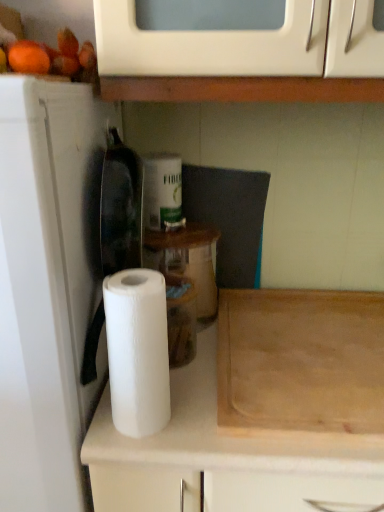
Question: Considering the relative sizes of wooden cutting board at lower right and white matte paper towel at center in the image provided, is wooden cutting board at lower right shorter than white matte paper towel at center?

Choices:
 (A) yes
 (B) no

Answer: (A)

Question: Is wooden cutting board at lower right at the left side of white matte paper towel at center?

Choices:
 (A) no
 (B) yes

Answer: (A)

Question: From the image's perspective, is wooden cutting board at lower right located beneath white matte paper towel at center?

Choices:
 (A) yes
 (B) no

Answer: (A)

Question: Does wooden cutting board at lower right have a greater height compared to white matte paper towel at center?

Choices:
 (A) yes
 (B) no

Answer: (B)

Question: Is wooden cutting board at lower right smaller than white matte paper towel at center?

Choices:
 (A) no
 (B) yes

Answer: (A)

Question: From a real-world perspective, is wooden cutting board at lower right physically below white matte paper towel at center?

Choices:
 (A) no
 (B) yes

Answer: (B)

Question: Can you confirm if white matte paper towel roll at center is taller than wooden cutting board at lower right?

Choices:
 (A) no
 (B) yes

Answer: (B)

Question: Considering the relative positions of white matte paper towel roll at center and wooden cutting board at lower right in the image provided, is white matte paper towel roll at center to the right of wooden cutting board at lower right from the viewer's perspective?

Choices:
 (A) no
 (B) yes

Answer: (A)

Question: Does white matte paper towel roll at center have a smaller size compared to wooden cutting board at lower right?

Choices:
 (A) yes
 (B) no

Answer: (B)

Question: Considering the relative positions of white matte paper towel roll at center and wooden cutting board at lower right in the image provided, is white matte paper towel roll at center to the left of wooden cutting board at lower right from the viewer's perspective?

Choices:
 (A) no
 (B) yes

Answer: (B)

Question: From a real-world perspective, is white matte paper towel roll at center located beneath wooden cutting board at lower right?

Choices:
 (A) no
 (B) yes

Answer: (B)

Question: Is the depth of white matte paper towel roll at center less than that of wooden cutting board at lower right?

Choices:
 (A) no
 (B) yes

Answer: (B)

Question: Can you confirm if wooden cutting board at lower right is thinner than white paper towel at left?

Choices:
 (A) no
 (B) yes

Answer: (A)